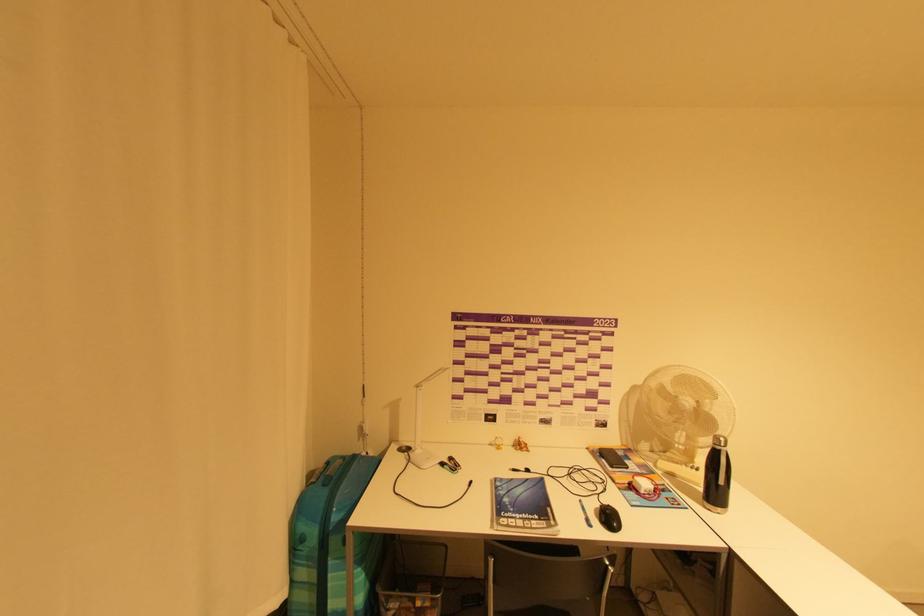
Find where to push the fan control buttons. Please return your answer as a coordinate pair (x, y).

(645, 487)